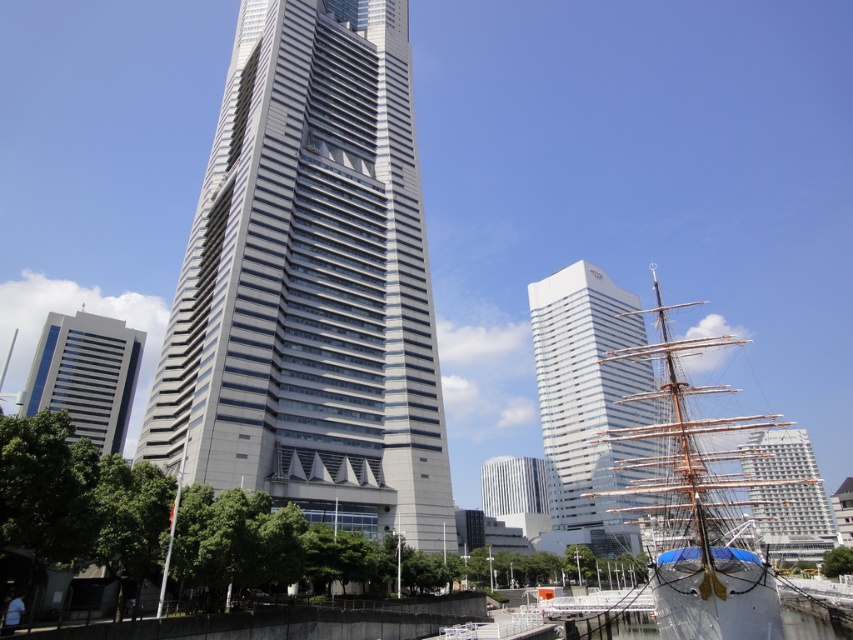
You are an architect designing a new bridge that needs to pass over the wooden ship at center and the white glossy building at center. According to the scene description, which structure requires a taller clearance for the bridge?

The wooden ship at center requires a taller clearance because it is much taller than the white glossy building at center.

You are standing on the dock and want to take a photo of both the wooden ship at center and the white glass tower at center. Which object should you position closer to the camera to include both in the frame?

The wooden ship at center is positioned over the white glass tower at center, so you should position the wooden ship at center closer to the camera to include both in the frame.